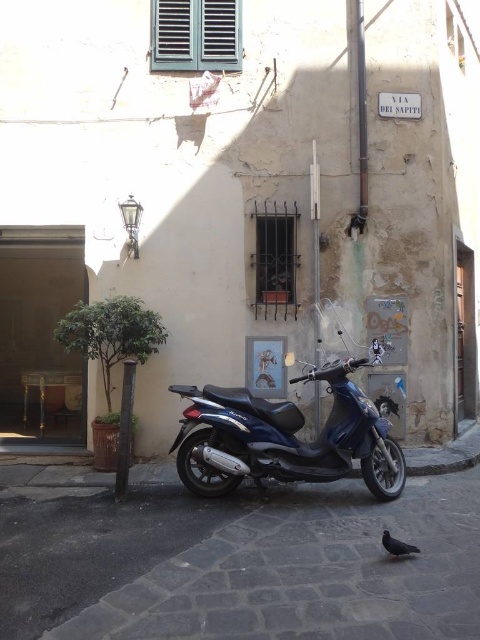
Question: Is shiny blue scooter at center below dark gray feathered pigeon at lower right?

Choices:
 (A) yes
 (B) no

Answer: (B)

Question: Which object appears closest to the camera in this image?

Choices:
 (A) dark gray feathered pigeon at lower right
 (B) shiny blue scooter at center

Answer: (A)

Question: Can you confirm if shiny blue scooter at center is wider than dark gray feathered pigeon at lower right?

Choices:
 (A) yes
 (B) no

Answer: (A)

Question: Which point is farther from the camera taking this photo?

Choices:
 (A) (384, 529)
 (B) (325, 372)

Answer: (B)

Question: Is shiny blue scooter at center positioned in front of dark gray feathered pigeon at lower right?

Choices:
 (A) yes
 (B) no

Answer: (B)